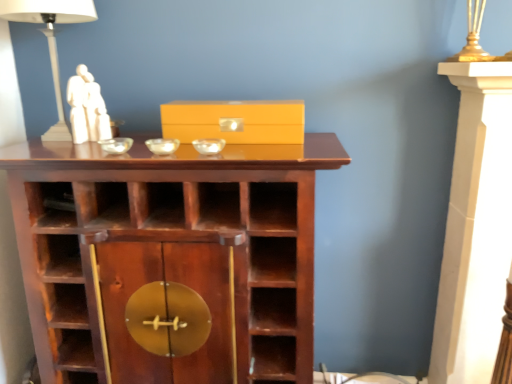
Find the location of a particular element. Image resolution: width=512 pixels, height=384 pixels. vacant space in between transparent glass bowl at center, which is the 2th glass bowl in right-to-left order, and matte yellow box at center is located at coordinates (213, 142).